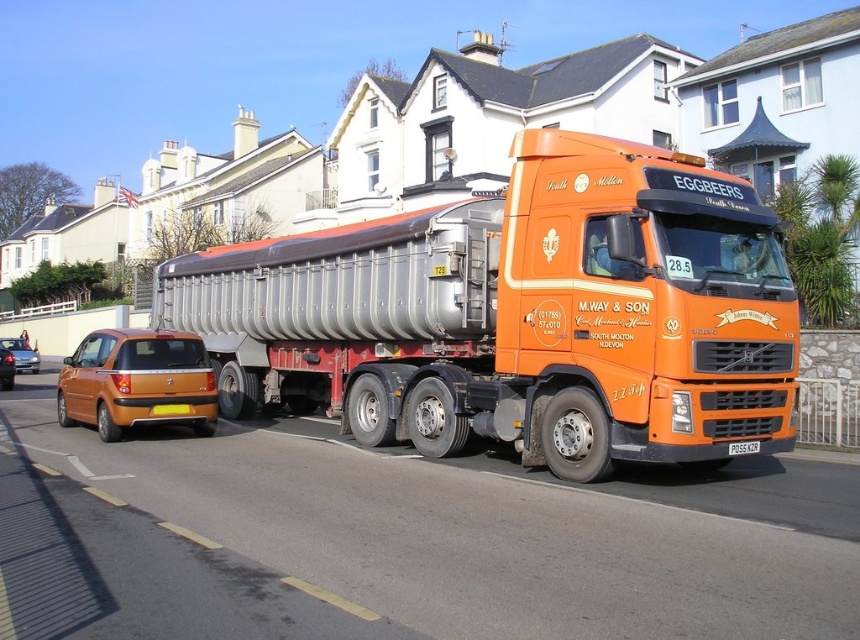
You are a pedestrian standing on the sidewalk and want to cross the street. The orange matte truck at center and metallic orange hatchback at left are parked on the road. Which vehicle should you check around first before crossing?

The orange matte truck at center is in front of the metallic orange hatchback at left, so you should check around the orange matte truck at center first before crossing the street to ensure visibility.

You are standing on the sidewalk next to the large orange articulated lorry with a metallic grey trailer. You want to cross the road to reach the other side. The point where you intend to cross is marked as point (330, 365). Given that the road is 15 meters wide, can you safely cross before the truck moves forward? Please explain your reasoning.

The point (330, 365) is 13.65 meters away from you. Since the road is 15 meters wide, the distance to the crossing point is less than the total road width. However, you must consider the truck might move forward. If the truck starts moving, it could block your path. To safely cross, ensure the truck is stationary and there is enough time to cross the remaining 1.35 meters before any potential movement.

You are a delivery driver who needs to park your van between the metallic orange hatchback at left and the whitemetalliclicense plate at right. Your van is 4 meters long. Is there enough space between them to park your van?

The distance between the metallic orange hatchback at left and the whitemetalliclicense plate at right is 8.84 meters. Since your van is only 4 meters long, there is sufficient space to park between them.